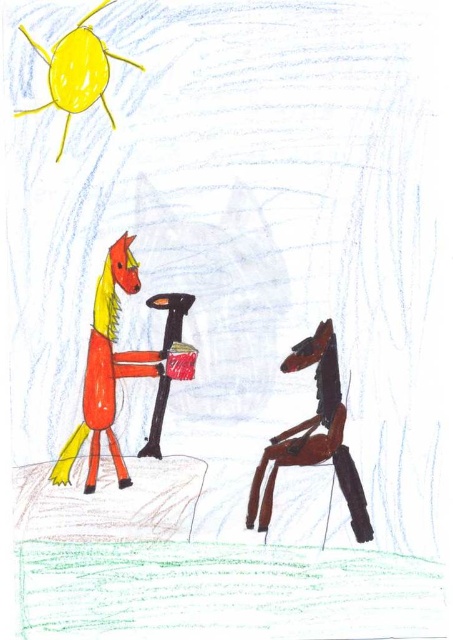
You are standing at the origin point in the image. Which of the two points, point [115,358] or point [80,35], is farther away from you?

Point [115,358] is farther away from you because it is behind point [80,35].